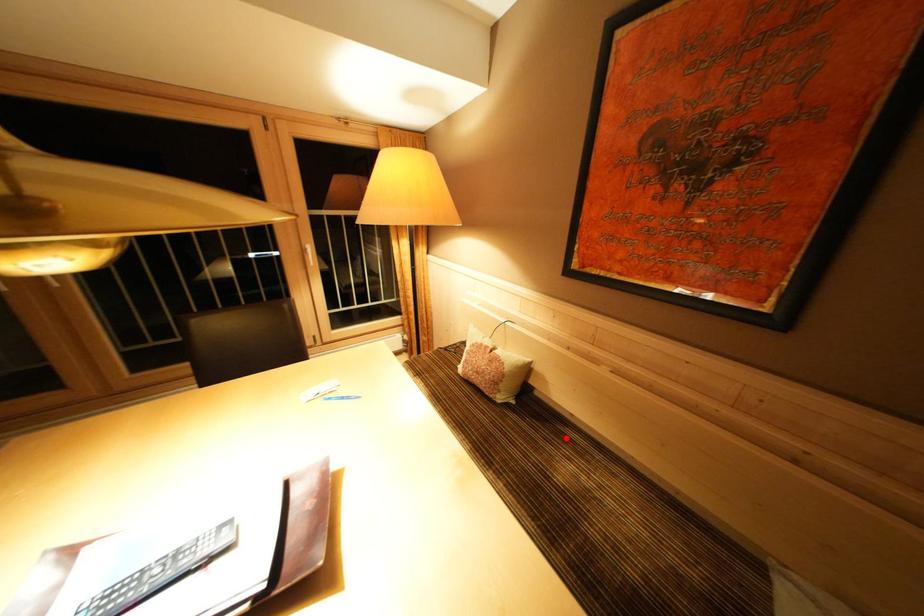
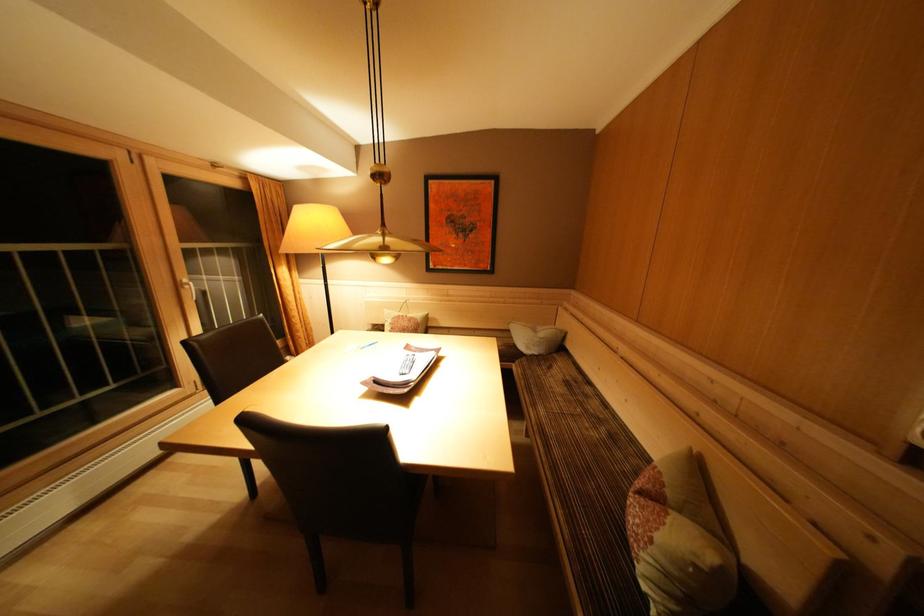
Question: I am providing you with two images of the same scene from different viewpoints. A red point is marked on the first image. At the location where the point appears in image 1, is it still visible in image 2?

Choices:
 (A) Yes
 (B) No

Answer: (B)